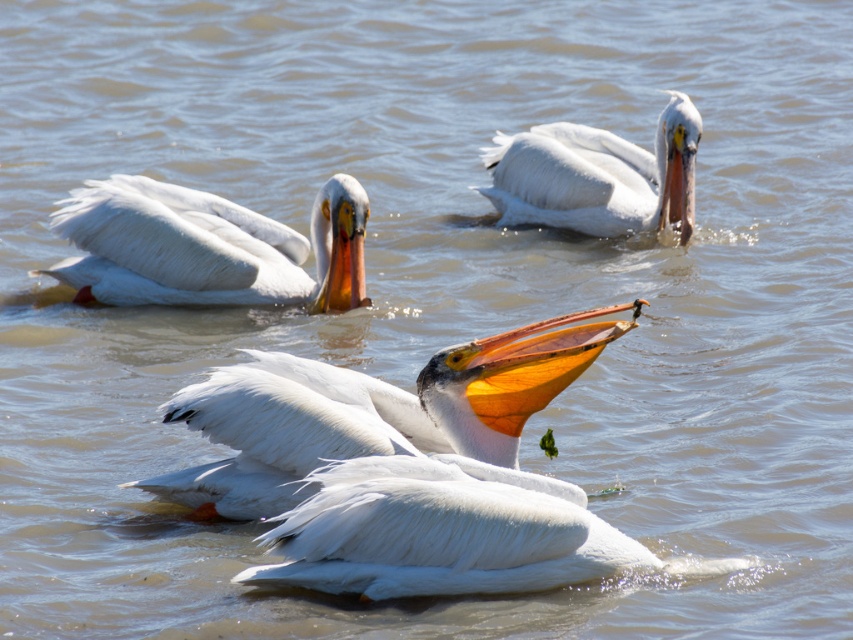
Question: Observing the image, what is the correct spatial positioning of white matte pelican at center in reference to white feathered pelican at center?

Choices:
 (A) above
 (B) below

Answer: (A)

Question: Which object is positioned closest to the white feathered pelican at center?

Choices:
 (A) white matte pelican at center
 (B) white matte pelican at upper right

Answer: (A)

Question: Is white matte pelican at center positioned at the back of white matte pelican at upper left?

Choices:
 (A) yes
 (B) no

Answer: (B)

Question: Where is white feathered pelican at center located in relation to white matte pelican at upper left in the image?

Choices:
 (A) above
 (B) below

Answer: (B)

Question: Which point appears farthest from the camera in this image?

Choices:
 (A) (575, 163)
 (B) (503, 417)

Answer: (A)

Question: Which point is closer to the camera?

Choices:
 (A) white matte pelican at upper left
 (B) white matte pelican at upper right

Answer: (A)